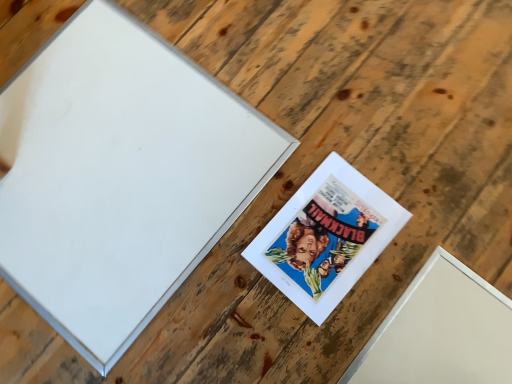
Describe the element at coordinates (326, 237) in the screenshot. I see `matte paper picture frame at center, arranged as the first picture frame when viewed from the right` at that location.

In the scene shown: What is the approximate width of matte paper picture frame at center, placed as the 2th picture frame when sorted from left to right?

12.20 inches.

What is the approximate height of matte paper picture frame at center, arranged as the first picture frame when viewed from the right?

matte paper picture frame at center, arranged as the first picture frame when viewed from the right, is 0.41 inches in height.

Image resolution: width=512 pixels, height=384 pixels. I want to click on matte paper picture frame at center, placed as the 2th picture frame when sorted from left to right, so click(326, 237).

Identify the location of white matte picture frame at upper left, which is counted as the first picture frame, starting from the left. This screenshot has height=384, width=512. (119, 176).

The height and width of the screenshot is (384, 512). Describe the element at coordinates (119, 176) in the screenshot. I see `white matte picture frame at upper left, placed as the 2th picture frame when sorted from right to left` at that location.

Locate an element on the screen. The width and height of the screenshot is (512, 384). matte paper picture frame at center, arranged as the first picture frame when viewed from the right is located at coordinates (326, 237).

Which object is positioned more to the right, white matte picture frame at upper left, which is counted as the first picture frame, starting from the left, or matte paper picture frame at center, placed as the 2th picture frame when sorted from left to right?

Positioned to the right is matte paper picture frame at center, placed as the 2th picture frame when sorted from left to right.

Which is behind, white matte picture frame at upper left, which is counted as the first picture frame, starting from the left, or matte paper picture frame at center, placed as the 2th picture frame when sorted from left to right?

matte paper picture frame at center, placed as the 2th picture frame when sorted from left to right.

Is point (60, 233) more distant than point (272, 244)?

Yes, it is behind point (272, 244).

From the image's perspective, which is below, white matte picture frame at upper left, which is counted as the first picture frame, starting from the left, or matte paper picture frame at center, placed as the 2th picture frame when sorted from left to right?

matte paper picture frame at center, placed as the 2th picture frame when sorted from left to right, is shown below in the image.

From a real-world perspective, does white matte picture frame at upper left, which is counted as the first picture frame, starting from the left, sit lower than matte paper picture frame at center, placed as the 2th picture frame when sorted from left to right?

No, from a real-world perspective, white matte picture frame at upper left, which is counted as the first picture frame, starting from the left, is not beneath matte paper picture frame at center, placed as the 2th picture frame when sorted from left to right.

Considering the sizes of white matte picture frame at upper left, placed as the 2th picture frame when sorted from right to left, and matte paper picture frame at center, arranged as the first picture frame when viewed from the right, in the image, is white matte picture frame at upper left, placed as the 2th picture frame when sorted from right to left, wider or thinner than matte paper picture frame at center, arranged as the first picture frame when viewed from the right,?

white matte picture frame at upper left, placed as the 2th picture frame when sorted from right to left, is wider than matte paper picture frame at center, arranged as the first picture frame when viewed from the right.

Considering the relative sizes of white matte picture frame at upper left, placed as the 2th picture frame when sorted from right to left, and matte paper picture frame at center, placed as the 2th picture frame when sorted from left to right, in the image provided, is white matte picture frame at upper left, placed as the 2th picture frame when sorted from right to left, shorter than matte paper picture frame at center, placed as the 2th picture frame when sorted from left to right,?

Incorrect, the height of white matte picture frame at upper left, placed as the 2th picture frame when sorted from right to left, does not fall short of that of matte paper picture frame at center, placed as the 2th picture frame when sorted from left to right.

Considering the sizes of objects white matte picture frame at upper left, which is counted as the first picture frame, starting from the left, and matte paper picture frame at center, arranged as the first picture frame when viewed from the right, in the image provided, who is smaller, white matte picture frame at upper left, which is counted as the first picture frame, starting from the left, or matte paper picture frame at center, arranged as the first picture frame when viewed from the right,?

matte paper picture frame at center, arranged as the first picture frame when viewed from the right, is smaller.

Is white matte picture frame at upper left, which is counted as the first picture frame, starting from the left, completely or partially outside of matte paper picture frame at center, arranged as the first picture frame when viewed from the right?

Yes, white matte picture frame at upper left, which is counted as the first picture frame, starting from the left, is located beyond the bounds of matte paper picture frame at center, arranged as the first picture frame when viewed from the right.

Is the surface of white matte picture frame at upper left, placed as the 2th picture frame when sorted from right to left, in direct contact with matte paper picture frame at center, placed as the 2th picture frame when sorted from left to right?

No, white matte picture frame at upper left, placed as the 2th picture frame when sorted from right to left, is not next to matte paper picture frame at center, placed as the 2th picture frame when sorted from left to right.

Is matte paper picture frame at center, arranged as the first picture frame when viewed from the right, at the back of white matte picture frame at upper left, which is counted as the first picture frame, starting from the left?

No, white matte picture frame at upper left, which is counted as the first picture frame, starting from the left, is not facing away from matte paper picture frame at center, arranged as the first picture frame when viewed from the right.

Image resolution: width=512 pixels, height=384 pixels. In order to click on picture frame behind the white matte picture frame at upper left, placed as the 2th picture frame when sorted from right to left in this screenshot , I will do `click(326, 237)`.

Is matte paper picture frame at center, placed as the 2th picture frame when sorted from left to right, to the left of white matte picture frame at upper left, placed as the 2th picture frame when sorted from right to left, from the viewer's perspective?

No, matte paper picture frame at center, placed as the 2th picture frame when sorted from left to right, is not to the left of white matte picture frame at upper left, placed as the 2th picture frame when sorted from right to left.

Does matte paper picture frame at center, placed as the 2th picture frame when sorted from left to right, lie behind white matte picture frame at upper left, which is counted as the first picture frame, starting from the left?

Yes.

Which point is more distant from viewer, [344,197] or [67,219]?

The point [67,219] is more distant.

From the image's perspective, which is below, matte paper picture frame at center, arranged as the first picture frame when viewed from the right, or white matte picture frame at upper left, placed as the 2th picture frame when sorted from right to left?

matte paper picture frame at center, arranged as the first picture frame when viewed from the right.

From a real-world perspective, is matte paper picture frame at center, placed as the 2th picture frame when sorted from left to right, beneath white matte picture frame at upper left, placed as the 2th picture frame when sorted from right to left?

Yes, from a real-world perspective, matte paper picture frame at center, placed as the 2th picture frame when sorted from left to right, is beneath white matte picture frame at upper left, placed as the 2th picture frame when sorted from right to left.

Can you confirm if matte paper picture frame at center, arranged as the first picture frame when viewed from the right, is thinner than white matte picture frame at upper left, which is counted as the first picture frame, starting from the left?

Correct, the width of matte paper picture frame at center, arranged as the first picture frame when viewed from the right, is less than that of white matte picture frame at upper left, which is counted as the first picture frame, starting from the left.

Is matte paper picture frame at center, placed as the 2th picture frame when sorted from left to right, taller than white matte picture frame at upper left, which is counted as the first picture frame, starting from the left?

No, matte paper picture frame at center, placed as the 2th picture frame when sorted from left to right, is not taller than white matte picture frame at upper left, which is counted as the first picture frame, starting from the left.

Can you confirm if matte paper picture frame at center, arranged as the first picture frame when viewed from the right, is smaller than white matte picture frame at upper left, placed as the 2th picture frame when sorted from right to left?

Correct, matte paper picture frame at center, arranged as the first picture frame when viewed from the right, occupies less space than white matte picture frame at upper left, placed as the 2th picture frame when sorted from right to left.

Could white matte picture frame at upper left, placed as the 2th picture frame when sorted from right to left, be considered to be inside matte paper picture frame at center, placed as the 2th picture frame when sorted from left to right?

No, matte paper picture frame at center, placed as the 2th picture frame when sorted from left to right, does not contain white matte picture frame at upper left, placed as the 2th picture frame when sorted from right to left.

Are matte paper picture frame at center, arranged as the first picture frame when viewed from the right, and white matte picture frame at upper left, which is counted as the first picture frame, starting from the left, far apart?

No, matte paper picture frame at center, arranged as the first picture frame when viewed from the right, is in close proximity to white matte picture frame at upper left, which is counted as the first picture frame, starting from the left.

Consider the image. Is white matte picture frame at upper left, which is counted as the first picture frame, starting from the left, at the back of matte paper picture frame at center, placed as the 2th picture frame when sorted from left to right?

No, matte paper picture frame at center, placed as the 2th picture frame when sorted from left to right, is not facing away from white matte picture frame at upper left, which is counted as the first picture frame, starting from the left.

What's the angular difference between matte paper picture frame at center, placed as the 2th picture frame when sorted from left to right, and white matte picture frame at upper left, placed as the 2th picture frame when sorted from right to left,'s facing directions?

1.59 degrees separate the facing orientations of matte paper picture frame at center, placed as the 2th picture frame when sorted from left to right, and white matte picture frame at upper left, placed as the 2th picture frame when sorted from right to left.

The height and width of the screenshot is (384, 512). I want to click on picture frame that appears on the right of white matte picture frame at upper left, which is counted as the first picture frame, starting from the left, so click(326, 237).

Locate an element on the screen. The height and width of the screenshot is (384, 512). picture frame lying above the matte paper picture frame at center, placed as the 2th picture frame when sorted from left to right (from the image's perspective) is located at coordinates (119, 176).

Where is `picture frame in front of the matte paper picture frame at center, placed as the 2th picture frame when sorted from left to right`? The width and height of the screenshot is (512, 384). picture frame in front of the matte paper picture frame at center, placed as the 2th picture frame when sorted from left to right is located at coordinates (119, 176).